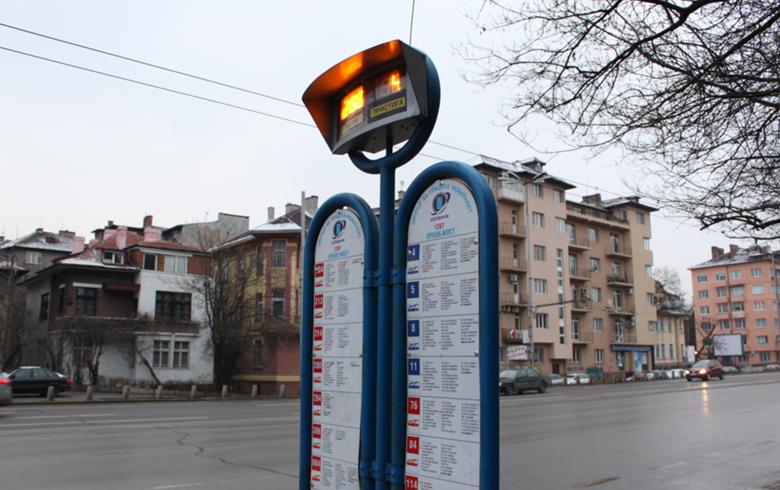
The image size is (780, 490). I want to click on light, so click(x=353, y=100), click(x=392, y=76).